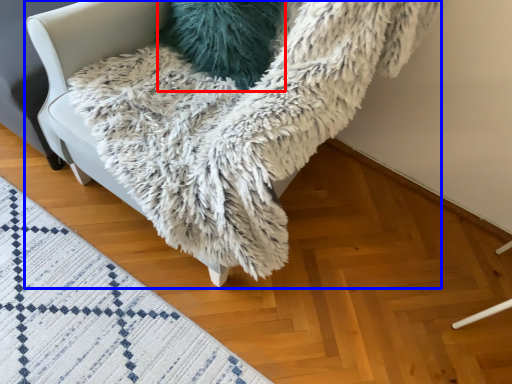
Question: Among these objects, which one is farthest to the camera, pillow (highlighted by a red box) or furniture (highlighted by a blue box)?

Choices:
 (A) pillow
 (B) furniture

Answer: (A)